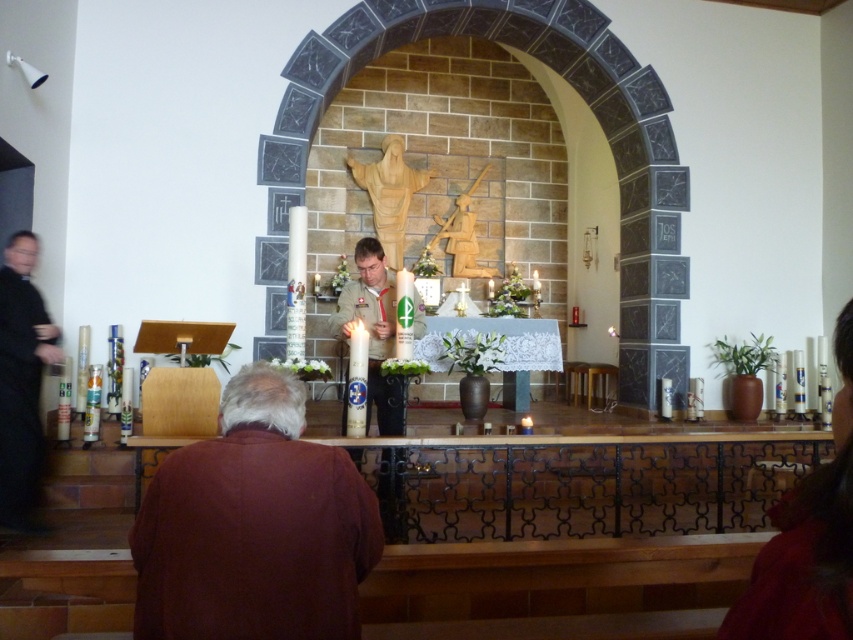
Who is taller, matte brown hair at lower right or smooth white candle at center?

smooth white candle at center

This screenshot has width=853, height=640. Identify the location of matte brown hair at lower right. (807, 540).

Is matte brown hair at lower right thinner than black clothed figure at left?

Correct, matte brown hair at lower right's width is less than black clothed figure at left's.

Who is positioned more to the right, matte brown hair at lower right or black clothed figure at left?

Positioned to the right is matte brown hair at lower right.

Is point (799, 502) farther from camera compared to point (4, 312)?

That is False.

Find the location of a particular element. The width and height of the screenshot is (853, 640). matte brown hair at lower right is located at coordinates (807, 540).

Between point (242, 536) and point (33, 321), which one is positioned in front?

Positioned in front is point (242, 536).

Who is taller, brown cotton shirt at lower center or black clothed figure at left?

black clothed figure at left

This screenshot has width=853, height=640. I want to click on brown cotton shirt at lower center, so click(x=254, y=525).